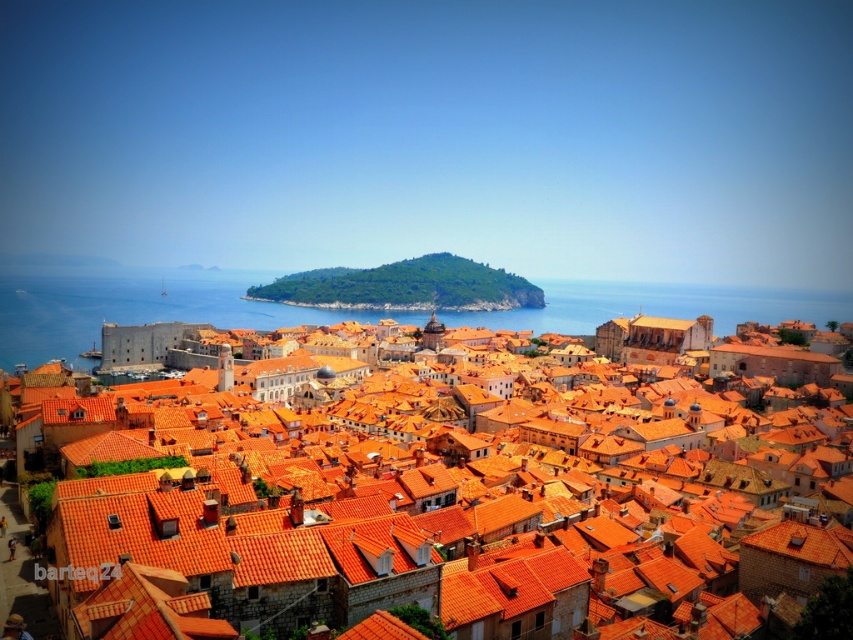
Does blue water at center appear under green leafy hillside at center?

Indeed, blue water at center is positioned under green leafy hillside at center.

Between point (212, 323) and point (398, 260), which one is positioned behind?

Positioned behind is point (398, 260).

Find the location of a particular element. This screenshot has height=640, width=853. blue water at center is located at coordinates [x=136, y=307].

Who is higher up, orange clay rooftops at center or green leafy hillside at center?

green leafy hillside at center is higher up.

Is orange clay rooftops at center shorter than green leafy hillside at center?

Yes.

Identify the location of orange clay rooftops at center. (253, 508).

Does orange clay rooftops at center have a smaller size compared to blue water at center?

Correct, orange clay rooftops at center occupies less space than blue water at center.

Can you confirm if orange clay rooftops at center is positioned to the left of blue water at center?

Yes, orange clay rooftops at center is to the left of blue water at center.

Does point (252, 506) lie behind point (148, 317)?

No, it is in front of (148, 317).

Locate an element on the screen. orange clay rooftops at center is located at coordinates (253, 508).